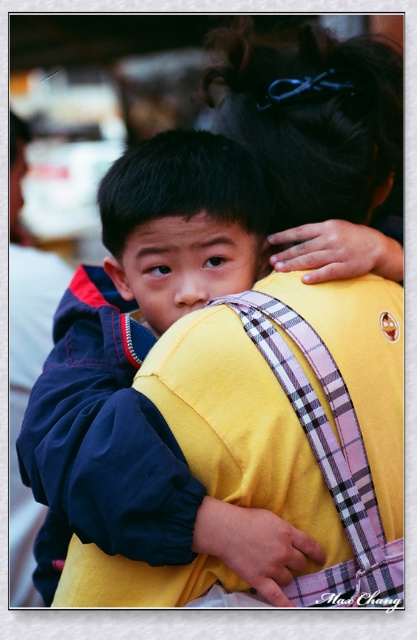
Which of these two, dark blue fleece jacket at upper left or plaid fabric backpack at upper center, stands shorter?

Standing shorter between the two is plaid fabric backpack at upper center.

Is dark blue fleece jacket at upper left further to camera compared to plaid fabric backpack at upper center?

No, it is in front of plaid fabric backpack at upper center.

Between point (168, 540) and point (251, 132), which one is positioned behind?

Point (251, 132)

Locate an element on the screen. The height and width of the screenshot is (640, 417). dark blue fleece jacket at upper left is located at coordinates (138, 365).